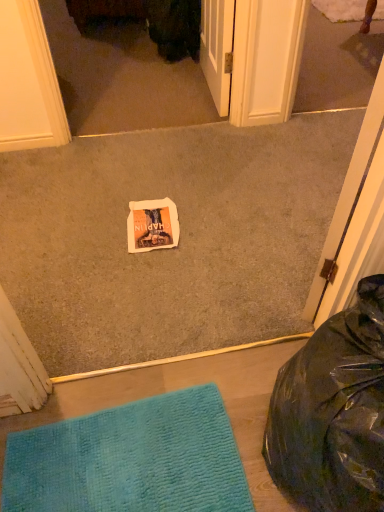
The image size is (384, 512). I want to click on unoccupied region to the right of white paper at center, so click(201, 232).